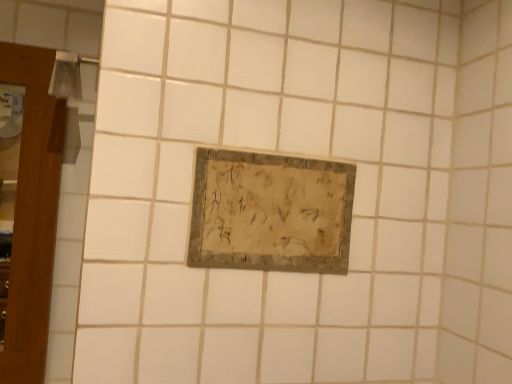
Find the location of a particular element. This screenshot has height=384, width=512. rustic wood sign at center is located at coordinates (270, 213).

What do you see at coordinates (270, 213) in the screenshot?
I see `rustic wood sign at center` at bounding box center [270, 213].

At what (x,y) coordinates should I click in order to perform the action: click on rustic wood sign at center. Please return your answer as a coordinate pair (x, y). Looking at the image, I should click on (270, 213).